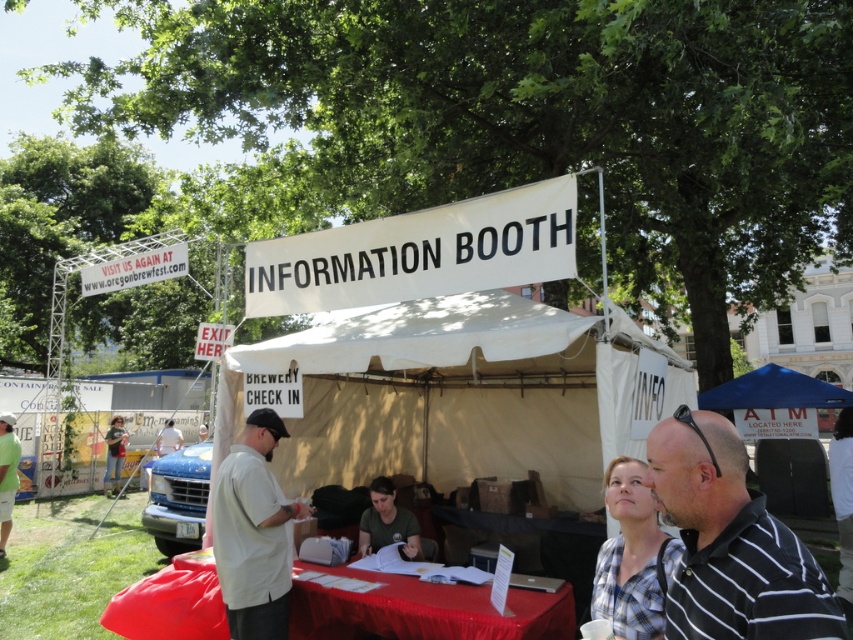
Question: Which of these objects is positioned farthest from the white cotton shirt at center?

Choices:
 (A) black striped polo shirt at lower right
 (B) light green shirt at lower left
 (C) matte green shirt at center
 (D) smooth red tablecloth at center

Answer: (B)

Question: Is black striped polo shirt at lower right to the left of smooth red tablecloth at center from the viewer's perspective?

Choices:
 (A) yes
 (B) no

Answer: (B)

Question: Which object appears farthest from the camera in this image?

Choices:
 (A) smooth red tablecloth at center
 (B) light green shirt at lower left
 (C) matte green shirt at center
 (D) black striped polo shirt at lower right

Answer: (B)

Question: Can you confirm if black striped polo shirt at lower right is positioned to the left of light green shirt at lower left?

Choices:
 (A) yes
 (B) no

Answer: (B)

Question: Which object is closer to the camera taking this photo?

Choices:
 (A) smooth red tablecloth at center
 (B) white cotton shirt at center
 (C) black striped polo shirt at lower right

Answer: (C)

Question: Is black striped polo shirt at lower right smaller than light green shirt at lower left?

Choices:
 (A) yes
 (B) no

Answer: (A)